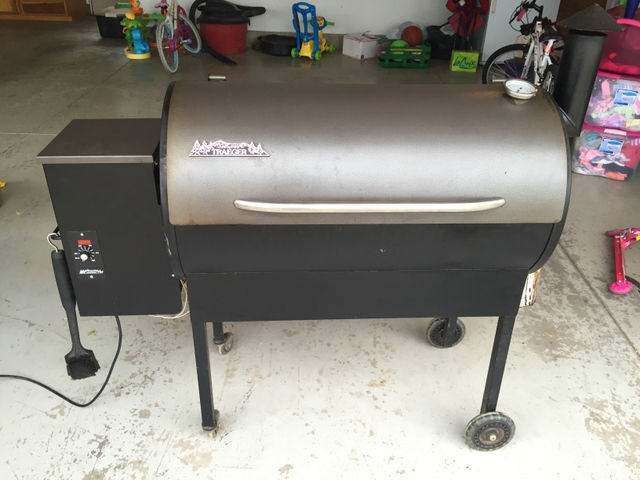
The image size is (640, 480). I want to click on dial knob, so click(84, 260).